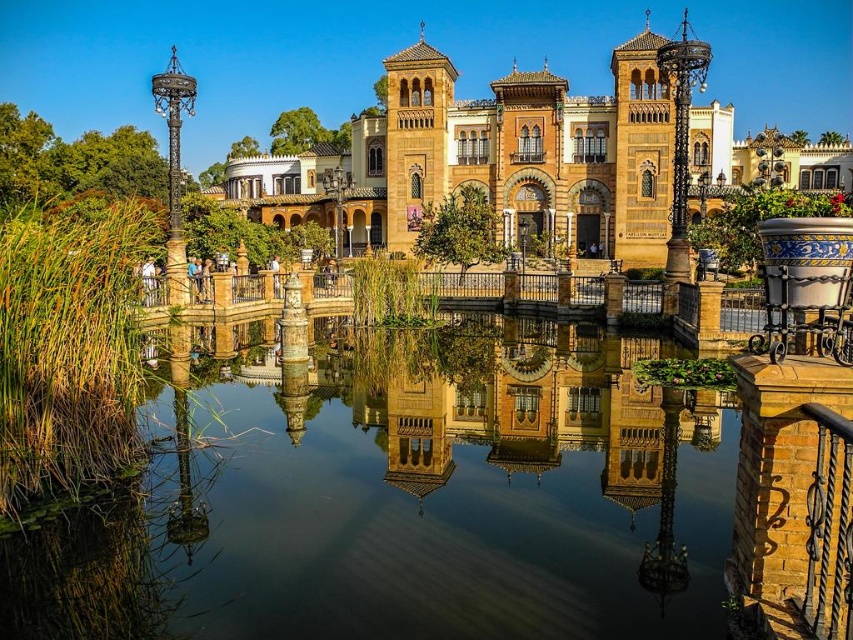
Is transparent water at center positioned before brown stone palace at center?

Yes.

Who is positioned more to the right, transparent water at center or brown stone palace at center?

brown stone palace at center

This screenshot has width=853, height=640. Describe the element at coordinates (407, 500) in the screenshot. I see `transparent water at center` at that location.

Identify the location of transparent water at center. (407, 500).